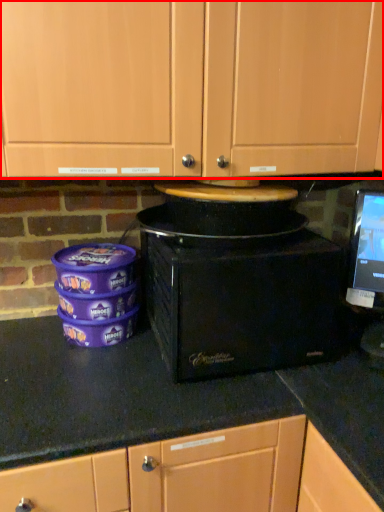
Question: Observing the image, what is the correct spatial positioning of cabinetry (annotated by the red box) in reference to home appliance?

Choices:
 (A) left
 (B) right

Answer: (A)